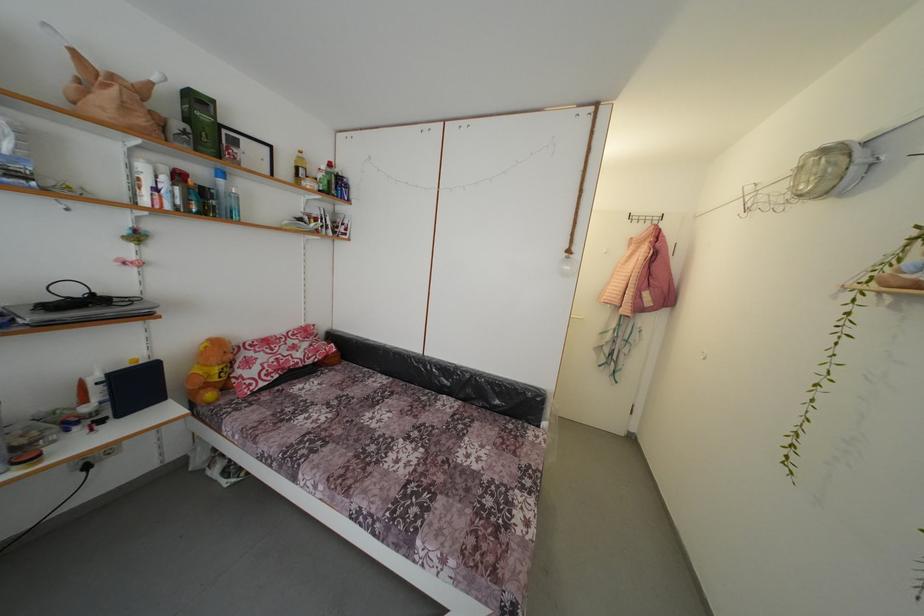
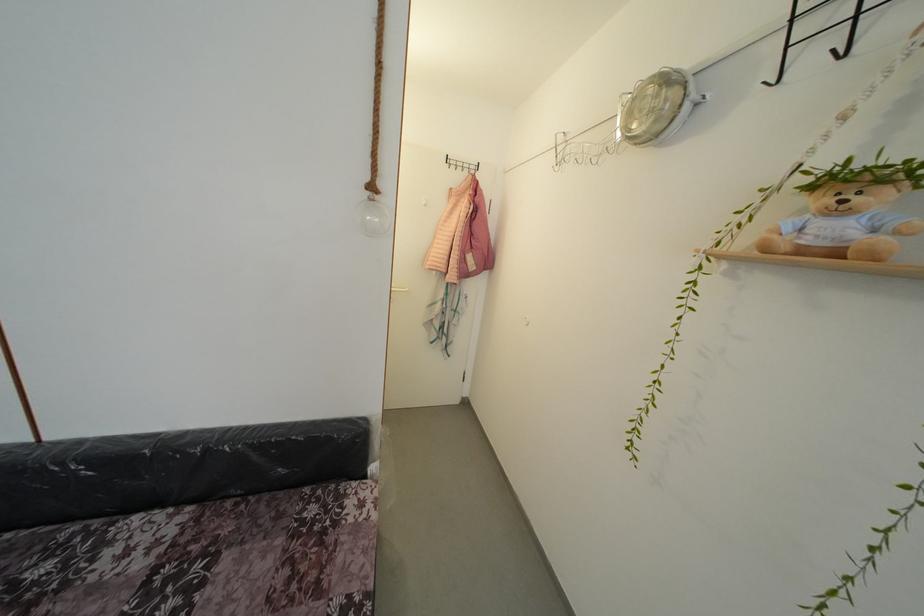
Question: The first image is from the beginning of the video and the second image is from the end. How did the camera likely rotate when shooting the video?

Choices:
 (A) Left
 (B) Right
 (C) Up
 (D) Down

Answer: (B)